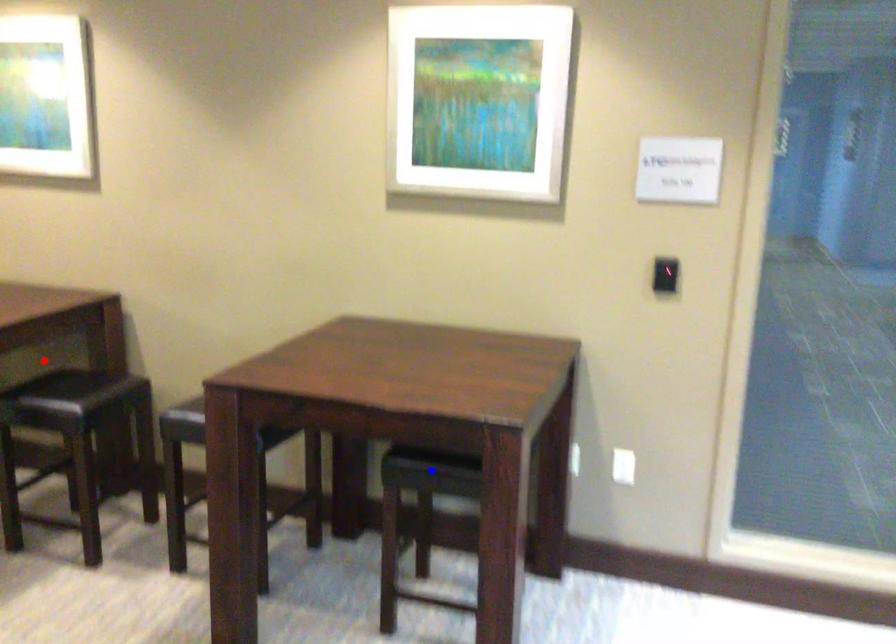
Question: Two points are marked on the image. Which point is closer to the camera?

Choices:
 (A) Blue point is closer.
 (B) Red point is closer.

Answer: (A)